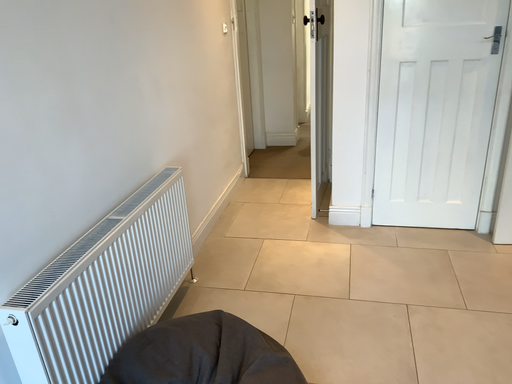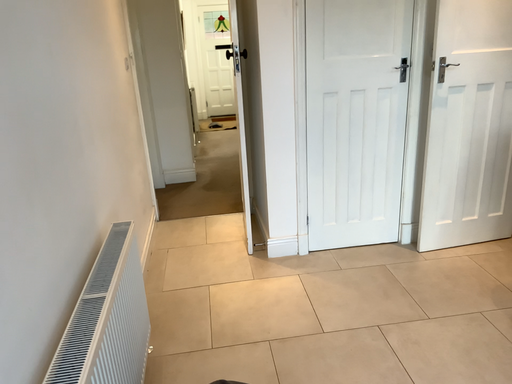
Question: Which way did the camera rotate in the video?

Choices:
 (A) rotated left
 (B) rotated right

Answer: (B)